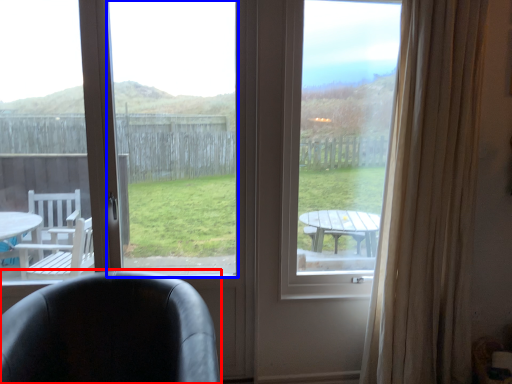
Question: Which object appears farthest to the camera in this image, chair (highlighted by a red box) or window screen (highlighted by a blue box)?

Choices:
 (A) chair
 (B) window screen

Answer: (B)